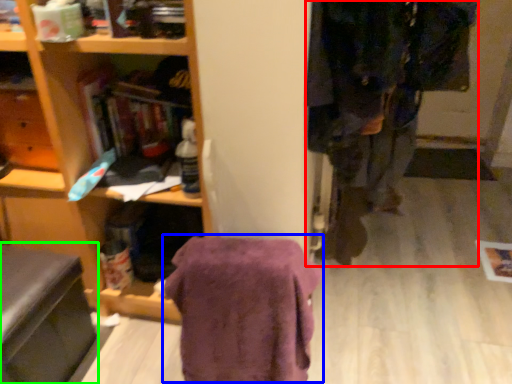
Question: Based on their relative distances, which object is farther from clothing (highlighted by a red box)? Choose from blanket (highlighted by a blue box) and swivel chair (highlighted by a green box).

Choices:
 (A) blanket
 (B) swivel chair

Answer: (B)